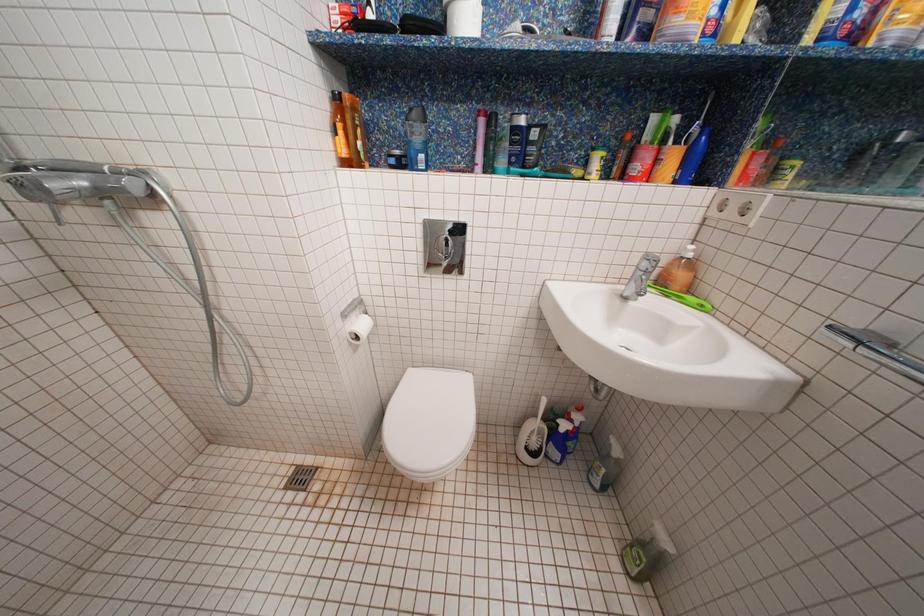
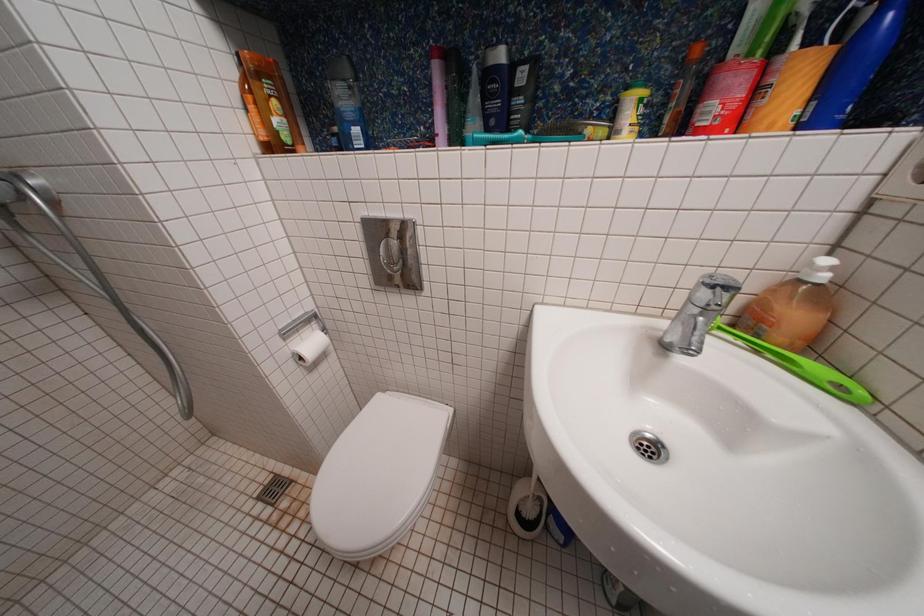
Question: The camera is either moving clockwise (left) or counter-clockwise (right) around the object. The first image is from the beginning of the video and the second image is from the end. Is the camera moving left or right when shooting the video?

Choices:
 (A) Left
 (B) Right

Answer: (B)